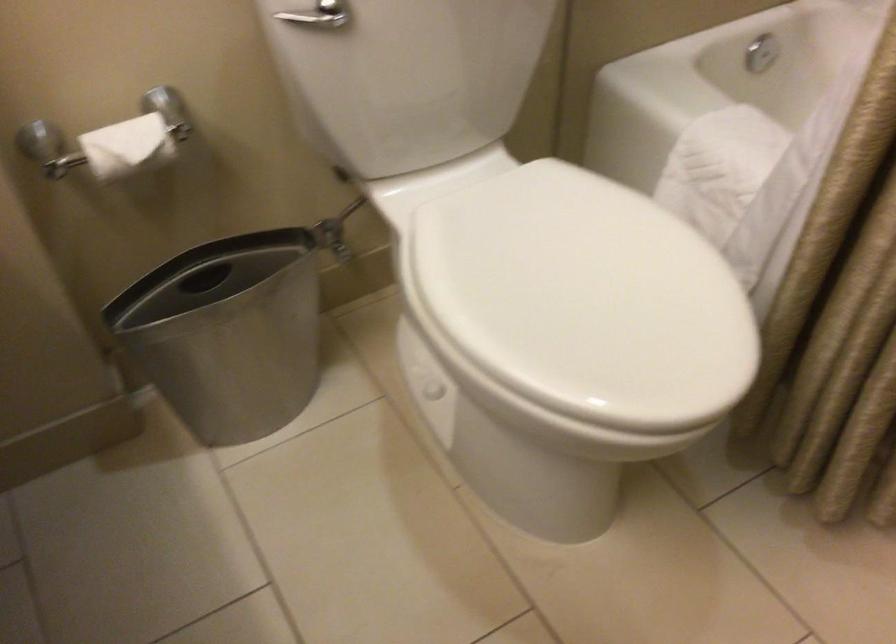
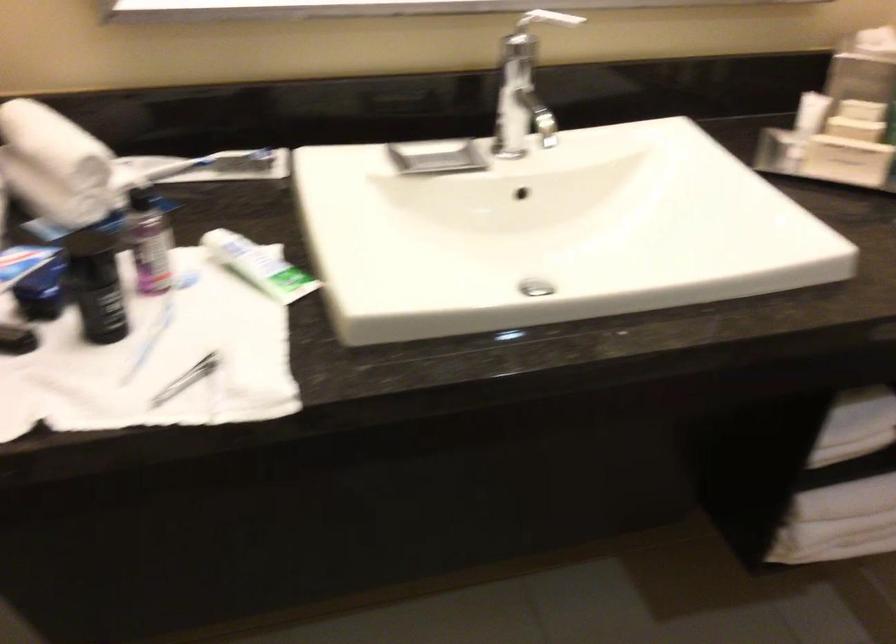
The first image is from the beginning of the video and the second image is from the end. How did the camera likely rotate when shooting the video?

The camera rotated toward left-down.